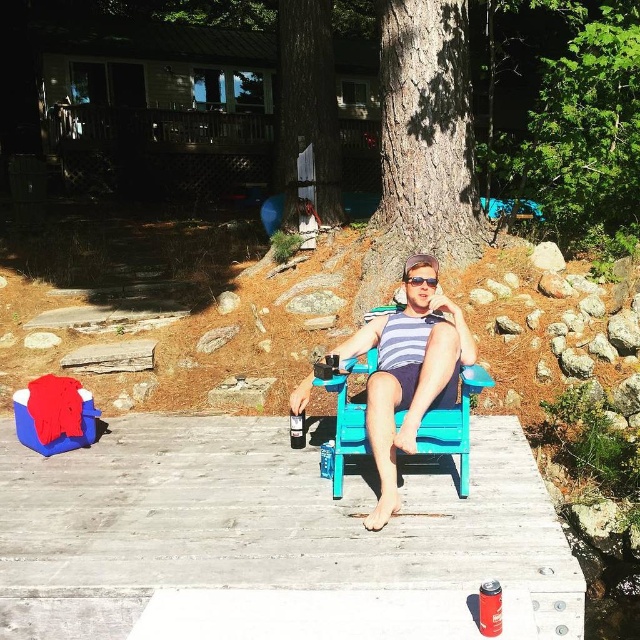
Looking at this image, is the position of brown rough bark tree at center less distant than that of green leafy tree at upper right?

Yes, it is.

Is brown rough bark tree at center positioned at the back of green leafy tree at upper right?

No, it is not.

Where is `brown rough bark tree at center`? This screenshot has height=640, width=640. brown rough bark tree at center is located at coordinates (422, 145).

Find the location of a particular element. This screenshot has width=640, height=640. brown rough bark tree at center is located at coordinates (422, 145).

Can you confirm if green leafy tree at upper right is thinner than metallic silver can at lower right?

No, green leafy tree at upper right is not thinner than metallic silver can at lower right.

This screenshot has width=640, height=640. What are the coordinates of `green leafy tree at upper right` in the screenshot? It's located at (588, 136).

Is point (616, 156) behind point (477, 628)?

Yes, point (616, 156) is farther from viewer.

What are the coordinates of `green leafy tree at upper right` in the screenshot? It's located at (588, 136).

Does wooden dock at center have a smaller size compared to metallic silver can at lower right?

Actually, wooden dock at center might be larger than metallic silver can at lower right.

Is point (13, 566) positioned before point (499, 616)?

No, it is not.

Locate an element on the screen. The height and width of the screenshot is (640, 640). wooden dock at center is located at coordinates (273, 518).